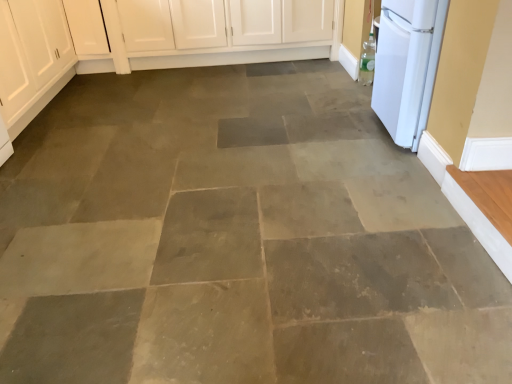
Question: In the image, is white matte refrigerator at right positioned in front of or behind matte white cabinet at left?

Choices:
 (A) behind
 (B) front

Answer: (B)

Question: From the image's perspective, is white matte refrigerator at right above or below matte white cabinet at left?

Choices:
 (A) above
 (B) below

Answer: (B)

Question: Considering the positions of point (394, 100) and point (61, 56), is point (394, 100) closer or farther from the camera than point (61, 56)?

Choices:
 (A) closer
 (B) farther

Answer: (A)

Question: Is point (28, 14) positioned closer to the camera than point (404, 107)?

Choices:
 (A) farther
 (B) closer

Answer: (A)

Question: Is matte white cabinet at left to the left or to the right of white matte refrigerator at right in the image?

Choices:
 (A) right
 (B) left

Answer: (B)

Question: From the image's perspective, is matte white cabinet at left positioned above or below white matte refrigerator at right?

Choices:
 (A) above
 (B) below

Answer: (A)

Question: Considering the positions of matte white cabinet at left and white matte refrigerator at right in the image, is matte white cabinet at left bigger or smaller than white matte refrigerator at right?

Choices:
 (A) big
 (B) small

Answer: (A)